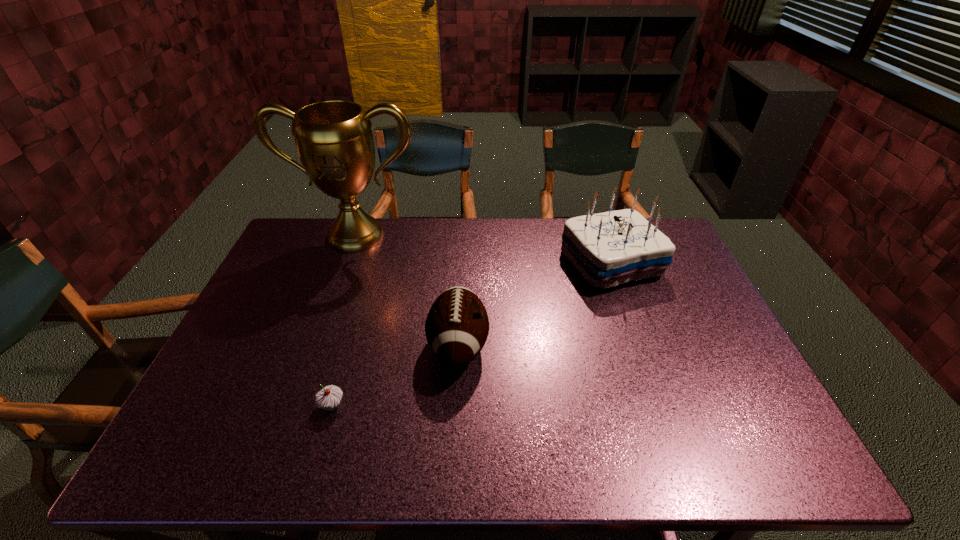
Identify the location of free region at the right edge of the desktop. The width and height of the screenshot is (960, 540). [676, 261].

At what (x,y) coordinates should I click in order to perform the action: click on free space between the tallest object and the birthday cake. Please return your answer as a coordinate pair (x, y). The height and width of the screenshot is (540, 960). Looking at the image, I should click on (484, 249).

Find the location of `free space between the tallest object and the second nearest object`. free space between the tallest object and the second nearest object is located at coordinates (407, 291).

I want to click on vacant region between the cupcake and the tallest object, so click(344, 321).

You are a GUI agent. You are given a task and a screenshot of the screen. Output one action in this format:
    pyautogui.click(x=<x>, y=<y>)
    Task: Click on the vacant space that's between the shortest object and the third object from left to right
    
    Given the screenshot: What is the action you would take?
    (x=396, y=376)

Find the location of a particular element. The height and width of the screenshot is (540, 960). free space between the birthday cake and the trophy cup is located at coordinates (484, 249).

Locate an element on the screen. This screenshot has width=960, height=540. free point between the cupcake and the trophy cup is located at coordinates (344, 321).

Locate an element on the screen. The image size is (960, 540). vacant point located between the shortest object and the tallest object is located at coordinates (344, 321).

You are a GUI agent. You are given a task and a screenshot of the screen. Output one action in this format:
    pyautogui.click(x=<x>, y=<y>)
    Task: Click on the empty space that is in between the third object from left to right and the cupcake
    
    Given the screenshot: What is the action you would take?
    pyautogui.click(x=396, y=376)

Where is `object that is the nearest to the shortest object`? object that is the nearest to the shortest object is located at coordinates (457, 326).